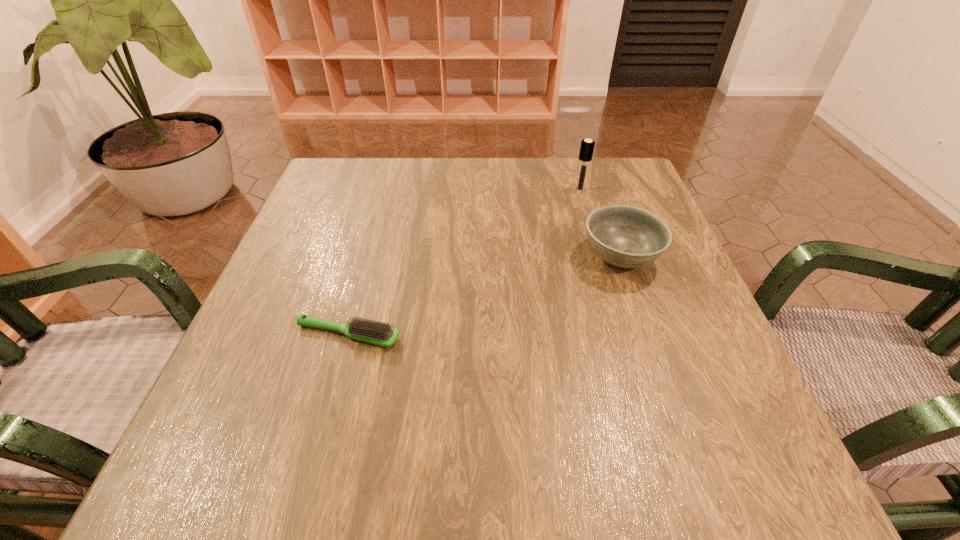
I want to click on vacant region at the near right corner of the desktop, so click(742, 481).

Find the location of `vacant point located between the leftmost object and the bowl`. vacant point located between the leftmost object and the bowl is located at coordinates (484, 296).

Locate an element on the screen. This screenshot has width=960, height=540. vacant area between the second tallest object and the nearest object is located at coordinates point(484,296).

The width and height of the screenshot is (960, 540). In order to click on vacant point located between the left hairbrush and the tallest object in this screenshot , I will do `click(464, 261)`.

Locate an element on the screen. empty space between the left hairbrush and the second shortest object is located at coordinates (484, 296).

Locate an element on the screen. The height and width of the screenshot is (540, 960). free point between the left hairbrush and the second farthest object is located at coordinates (484, 296).

Identify the location of vacant area between the farther hairbrush and the nearest object. (464, 261).

Locate an element on the screen. Image resolution: width=960 pixels, height=540 pixels. the second closest object to the farther hairbrush is located at coordinates (376, 332).

This screenshot has width=960, height=540. I want to click on object that stands as the second closest to the second tallest object, so coord(376,332).

Where is `free space in the image that satisfies the following two spatial constraints: 1. on the back side of the shorter hairbrush; 2. on the left side of the farthest object`? This screenshot has height=540, width=960. free space in the image that satisfies the following two spatial constraints: 1. on the back side of the shorter hairbrush; 2. on the left side of the farthest object is located at coordinates (388, 188).